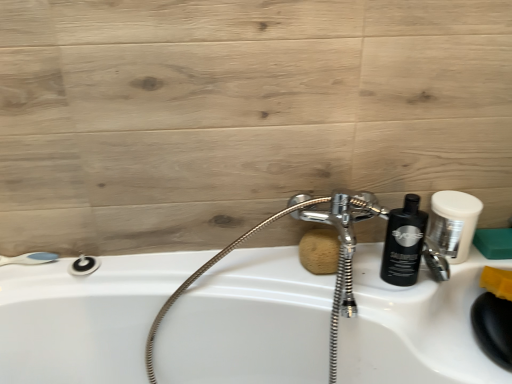
Question: Considering the relative sizes of green sponge at right, which ranks as the second soap in left-to-right order, and white matte shaving cream at upper right in the image provided, is green sponge at right, which ranks as the second soap in left-to-right order, wider than white matte shaving cream at upper right?

Choices:
 (A) yes
 (B) no

Answer: (B)

Question: Can you see green sponge at right, which ranks as the second soap in left-to-right order, touching white matte shaving cream at upper right?

Choices:
 (A) yes
 (B) no

Answer: (B)

Question: Is green sponge at right, which ranks as the second soap in left-to-right order, facing away from white matte shaving cream at upper right?

Choices:
 (A) yes
 (B) no

Answer: (B)

Question: From the image's perspective, would you say green sponge at right, marked as the 1th soap in a right-to-left arrangement, is positioned over white matte shaving cream at upper right?

Choices:
 (A) no
 (B) yes

Answer: (A)

Question: Considering the relative positions of green sponge at right, marked as the 1th soap in a right-to-left arrangement, and white matte shaving cream at upper right in the image provided, is green sponge at right, marked as the 1th soap in a right-to-left arrangement, to the right of white matte shaving cream at upper right from the viewer's perspective?

Choices:
 (A) yes
 (B) no

Answer: (A)

Question: Is white plastic shower at left, the 2th shower viewed from the right, inside or outside of white glossy sink at center?

Choices:
 (A) outside
 (B) inside

Answer: (A)

Question: Is white plastic shower at left, placed as the 1th shower when sorted from left to right, to the left or to the right of white glossy sink at center in the image?

Choices:
 (A) right
 (B) left

Answer: (B)

Question: From the image's perspective, is white plastic shower at left, the 2th shower viewed from the right, located above or below white glossy sink at center?

Choices:
 (A) above
 (B) below

Answer: (A)

Question: Is white plastic shower at left, the 2th shower viewed from the right, wider or thinner than white glossy sink at center?

Choices:
 (A) thin
 (B) wide

Answer: (A)

Question: Visually, is white matte shaving cream at upper right positioned to the left or to the right of brown sponge at center, which appears as the 1th soap when viewed from the left?

Choices:
 (A) right
 (B) left

Answer: (A)

Question: In terms of width, does white matte shaving cream at upper right look wider or thinner when compared to brown sponge at center, which appears as the 1th soap when viewed from the left?

Choices:
 (A) wide
 (B) thin

Answer: (A)

Question: Based on their sizes in the image, would you say white matte shaving cream at upper right is bigger or smaller than brown sponge at center, which appears as the 1th soap when viewed from the left?

Choices:
 (A) small
 (B) big

Answer: (B)

Question: From a real-world perspective, is white matte shaving cream at upper right positioned above or below brown sponge at center, which appears as the 1th soap when viewed from the left?

Choices:
 (A) above
 (B) below

Answer: (A)

Question: Relative to matte black shower at lower left, the second shower when ordered from left to right, is white plastic shower at left, the 2th shower viewed from the right, in front or behind?

Choices:
 (A) front
 (B) behind

Answer: (B)

Question: From the image's perspective, relative to matte black shower at lower left, the second shower when ordered from left to right, is white plastic shower at left, placed as the 1th shower when sorted from left to right, above or below?

Choices:
 (A) below
 (B) above

Answer: (B)